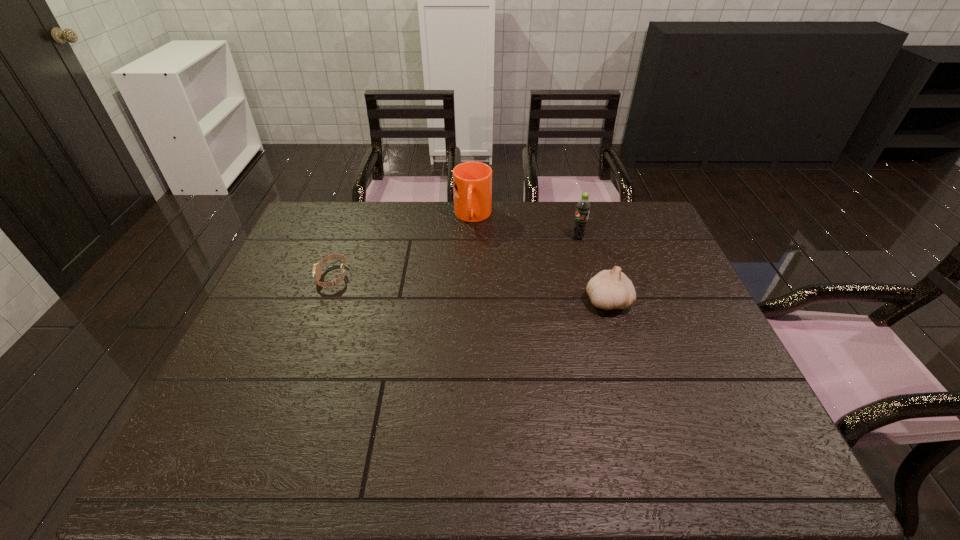
At what (x,y) coordinates should I click in order to perform the action: click on blank space at the right edge. Please return your answer as a coordinate pair (x, y). Looking at the image, I should click on (667, 266).

What are the coordinates of `vacant space at the far left corner of the desktop` in the screenshot? It's located at (313, 213).

Where is `free spot at the far right corner of the desktop`? Image resolution: width=960 pixels, height=540 pixels. free spot at the far right corner of the desktop is located at coordinates (667, 239).

Where is `blank region between the soda and the shortest object`? blank region between the soda and the shortest object is located at coordinates tap(455, 257).

Locate an element on the screen. empty space that is in between the third nearest object and the farthest object is located at coordinates (525, 227).

Where is `free spot between the garlic and the second object from left to right`? This screenshot has height=540, width=960. free spot between the garlic and the second object from left to right is located at coordinates (x=540, y=259).

Find the location of a particular element. Image resolution: width=960 pixels, height=540 pixels. free spot between the mug and the third tallest object is located at coordinates (540, 259).

At what (x,y) coordinates should I click in order to perform the action: click on vacant space in between the mug and the leftmost object. Please return your answer as a coordinate pair (x, y). This screenshot has width=960, height=540. Looking at the image, I should click on (403, 247).

This screenshot has height=540, width=960. In order to click on vacant area that lies between the leftmost object and the farthest object in this screenshot , I will do `click(403, 247)`.

Image resolution: width=960 pixels, height=540 pixels. What are the coordinates of `empty space that is in between the third tallest object and the leftmost object` in the screenshot? It's located at (470, 289).